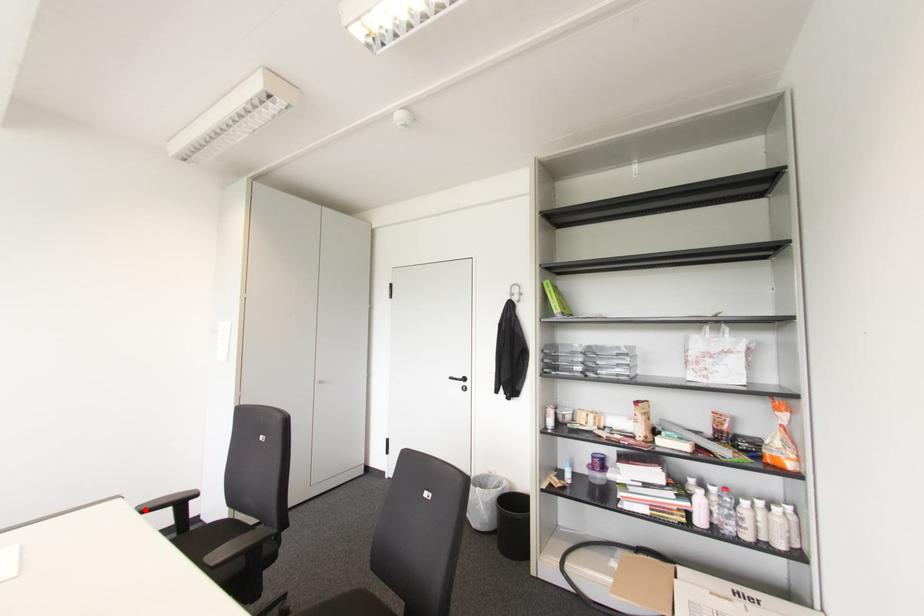
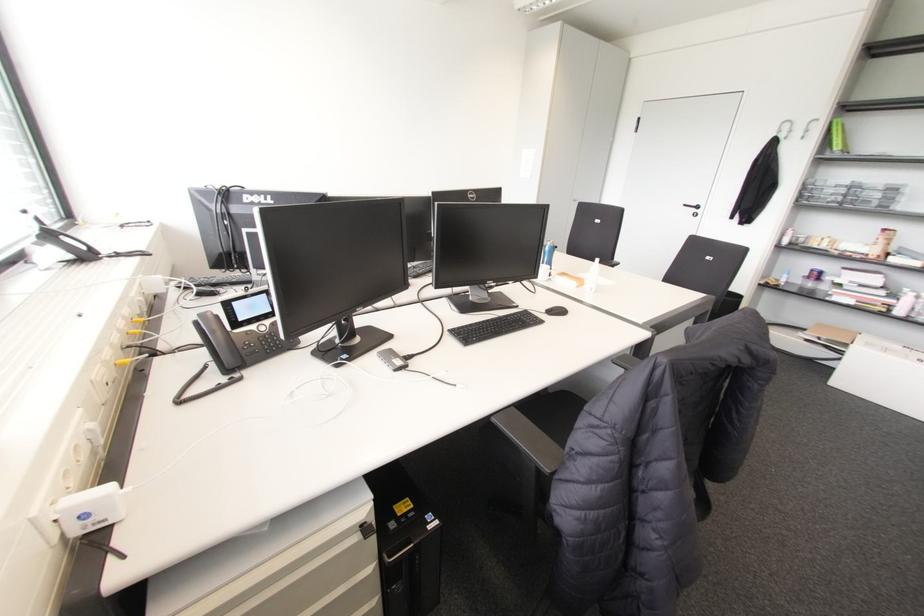
Question: I am providing you with two images of the same scene from different viewpoints. A red point is marked on the first image. At the location where the point appears in image 1, is it still visible in image 2?

Choices:
 (A) Yes
 (B) No

Answer: (B)